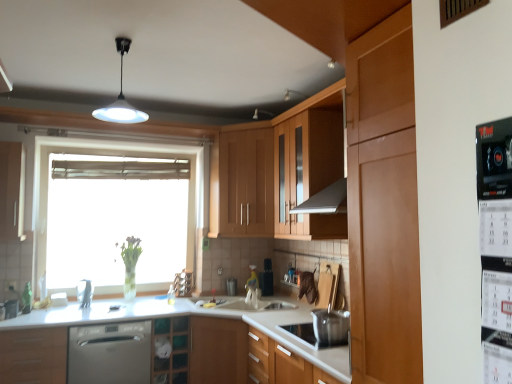
Question: From the image's perspective, is white glossy light fixture at upper center above or below matte wood cabinet at left, the fourth cabinetry viewed from the right?

Choices:
 (A) above
 (B) below

Answer: (A)

Question: From a real-world perspective, is white glossy light fixture at upper center positioned above or below matte wood cabinet at left, the fourth cabinetry viewed from the right?

Choices:
 (A) below
 (B) above

Answer: (B)

Question: Which object is positioned farthest from the white plastic electric outlet at lower left?

Choices:
 (A) black plastic calendar at right, which appears as the 1th appliance when viewed from the front
 (B) matte wood cabinet at left, marked as the first cabinetry in a left-to-right arrangement
 (C) black plastic toaster at center, placed as the 1th appliance when sorted from bottom to top
 (D) satin silver dishwasher at lower left
 (E) clear glass cabinet at center, the third cabinetry viewed from the left

Answer: (A)

Question: Which object is positioned closest to the stainless steel pot at lower center?

Choices:
 (A) matte wood cabinet at left, marked as the first cabinetry in a left-to-right arrangement
 (B) matte wood cabinet at lower left, which is the 3th cabinetry from right to left
 (C) satin silver dishwasher at lower left
 (D) black plastic calendar at right, acting as the second appliance starting from the back
 (E) white glossy light fixture at upper center

Answer: (C)